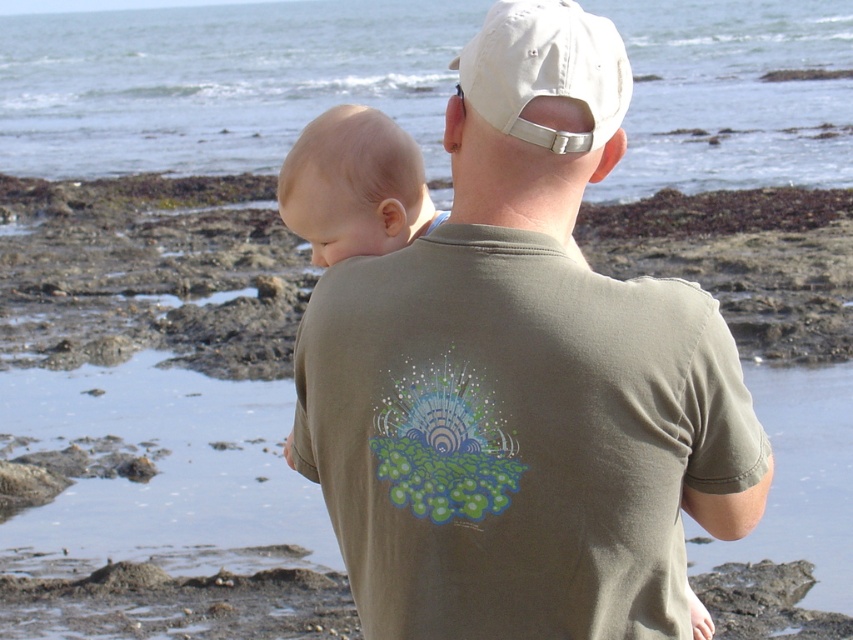
Question: Does clear blue water at upper center appear over white fabric baseball cap at upper center?

Choices:
 (A) yes
 (B) no

Answer: (A)

Question: Which point is closer to the camera?

Choices:
 (A) (407, 96)
 (B) (292, 205)
 (C) (564, 468)
 (D) (567, 4)

Answer: (C)

Question: Which of the following is the closest to the observer?

Choices:
 (A) clear blue water at upper center
 (B) white fabric baseball cap at upper center
 (C) olive green t-shirt at center
 (D) smooth beige baby at center

Answer: (C)

Question: Can you confirm if olive green t-shirt at center is positioned above smooth beige baby at center?

Choices:
 (A) yes
 (B) no

Answer: (B)

Question: Among these points, which one is nearest to the camera?

Choices:
 (A) (399, 444)
 (B) (171, 108)
 (C) (523, 49)

Answer: (C)

Question: Does clear blue water at upper center appear on the left side of smooth beige baby at center?

Choices:
 (A) no
 (B) yes

Answer: (A)